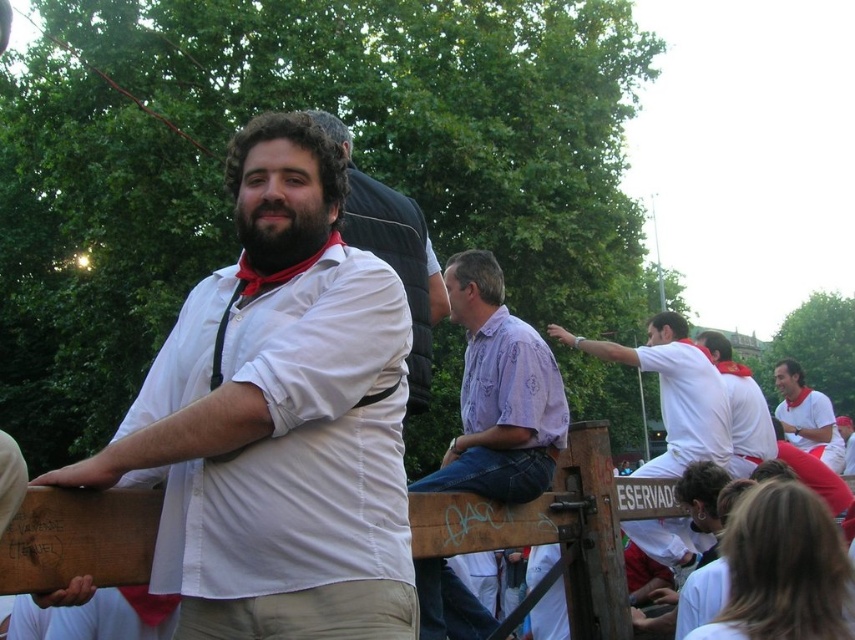
You are at the park and see a man in a white shirt with rolled up sleeves and a red bandana standing near a wooden structure with graffiti. There is an object at point (280, 419). What is located at that point?

The khaki pants at center is located at point (280, 419).

You are a photographer at the event and want to capture both the khaki pants at center and the purple patterned shirt at center in the same frame. Which object should you position closer to the left side of your camera viewfinder to ensure both are included?

To include both the khaki pants at center and the purple patterned shirt at center in the same frame, position the khaki pants at center closer to the left side of your camera viewfinder since it is already to the left of the purple patterned shirt at center.

You are a tailor observing the khaki pants at center and the purple patterned shirt at center. Which item has a greater width?

The khaki pants at center has a greater width than the purple patterned shirt at center.